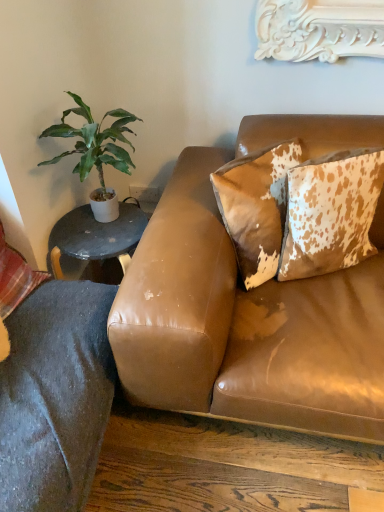
Question: Is cowhide pillow at upper right, marked as the 3th pillow in a left-to-right arrangement, to the left or to the right of brown textured pillow at upper right, which is counted as the second pillow, starting from the right, in the image?

Choices:
 (A) right
 (B) left

Answer: (A)

Question: Relative to brown textured pillow at upper right, which is counted as the second pillow, starting from the right, is cowhide pillow at upper right, the 1th pillow when ordered from right to left, in front or behind?

Choices:
 (A) behind
 (B) front

Answer: (B)

Question: Which object is the farthest from the plaid fabric pillow at lower left, which is the 3th pillow from right to left?

Choices:
 (A) green leafy plant at left
 (B) brown leather couch at upper right
 (C) brown textured pillow at upper right, which appears as the 2th pillow when viewed from the left
 (D) cowhide pillow at upper right, marked as the 3th pillow in a left-to-right arrangement

Answer: (D)

Question: Which object is positioned closest to the plaid fabric pillow at lower left, which is the 3th pillow from right to left?

Choices:
 (A) cowhide pillow at upper right, the 1th pillow when ordered from right to left
 (B) green leafy plant at left
 (C) brown leather couch at upper right
 (D) brown textured pillow at upper right, which appears as the 2th pillow when viewed from the left

Answer: (B)